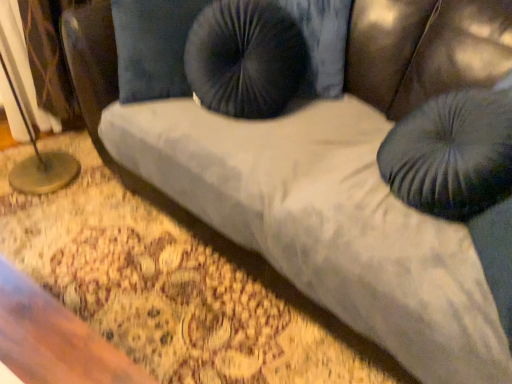
The width and height of the screenshot is (512, 384). What do you see at coordinates (452, 154) in the screenshot?
I see `velvet dark blue bean bag at upper center` at bounding box center [452, 154].

The image size is (512, 384). I want to click on velvet dark blue bean bag at upper center, so click(452, 154).

Is metallic gold table lamp at left thinner than suede-like black pillow at center?

No.

Between metallic gold table lamp at left and suede-like black pillow at center, which one has less height?

suede-like black pillow at center.

Which object is closer to the camera taking this photo, metallic gold table lamp at left or suede-like black pillow at center?

suede-like black pillow at center.

Looking at this image, how many degrees apart are the facing directions of metallic gold table lamp at left and suede-like black pillow at center?

35.1 degrees.

Considering the relative sizes of suede-like black pillow at center and metallic gold table lamp at left in the image provided, is suede-like black pillow at center thinner than metallic gold table lamp at left?

Indeed, suede-like black pillow at center has a lesser width compared to metallic gold table lamp at left.

Would you say suede-like black pillow at center contains metallic gold table lamp at left?

Actually, metallic gold table lamp at left is outside suede-like black pillow at center.

From a real-world perspective, is suede-like black pillow at center positioned above or below metallic gold table lamp at left?

suede-like black pillow at center is situated higher than metallic gold table lamp at left in the real world.

Considering the sizes of objects suede-like black pillow at center and metallic gold table lamp at left in the image provided, who is taller, suede-like black pillow at center or metallic gold table lamp at left?

metallic gold table lamp at left.

Which object is thinner, velvet dark blue bean bag at upper center or metallic gold table lamp at left?

With smaller width is velvet dark blue bean bag at upper center.

Is point (444, 177) closer to camera compared to point (72, 180)?

Yes, point (444, 177) is closer to viewer.

From the image's perspective, is velvet dark blue bean bag at upper center over metallic gold table lamp at left?

Actually, velvet dark blue bean bag at upper center appears below metallic gold table lamp at left in the image.

Considering the sizes of velvet dark blue bean bag at upper center and metallic gold table lamp at left in the image, is velvet dark blue bean bag at upper center taller or shorter than metallic gold table lamp at left?

Considering their sizes, velvet dark blue bean bag at upper center has less height than metallic gold table lamp at left.

Could velvet dark blue bean bag at upper center be considered to be inside metallic gold table lamp at left?

Definitely not — velvet dark blue bean bag at upper center is not inside metallic gold table lamp at left.

Who is taller, metallic gold table lamp at left or velvet dark blue bean bag at upper center?

metallic gold table lamp at left is taller.

From the image's perspective, would you say metallic gold table lamp at left is positioned over velvet dark blue bean bag at upper center?

Yes, from the image's perspective, metallic gold table lamp at left is over velvet dark blue bean bag at upper center.

Is metallic gold table lamp at left next to velvet dark blue bean bag at upper center?

No, metallic gold table lamp at left is not with velvet dark blue bean bag at upper center.

From the picture: Considering the relative sizes of suede-like black pillow at center and velvet dark blue bean bag at upper center in the image provided, is suede-like black pillow at center shorter than velvet dark blue bean bag at upper center?

No, suede-like black pillow at center is not shorter than velvet dark blue bean bag at upper center.

Can you confirm if suede-like black pillow at center is smaller than velvet dark blue bean bag at upper center?

Incorrect, suede-like black pillow at center is not smaller in size than velvet dark blue bean bag at upper center.

The height and width of the screenshot is (384, 512). I want to click on bean bag chair located below the suede-like black pillow at center (from the image's perspective), so click(452, 154).

Is velvet dark blue bean bag at upper center oriented away from suede-like black pillow at center?

No, velvet dark blue bean bag at upper center is not facing away from suede-like black pillow at center.

Between velvet dark blue bean bag at upper center and suede-like black pillow at center, which one has more height?

With more height is suede-like black pillow at center.

Which of these two, velvet dark blue bean bag at upper center or suede-like black pillow at center, is bigger?

With larger size is suede-like black pillow at center.

Considering the sizes of objects velvet dark blue bean bag at upper center and suede-like black pillow at center in the image provided, who is thinner, velvet dark blue bean bag at upper center or suede-like black pillow at center?

suede-like black pillow at center is thinner.

The width and height of the screenshot is (512, 384). What are the coordinates of `pillow located above the metallic gold table lamp at left (from a real-world perspective)` in the screenshot? It's located at (153, 47).

The image size is (512, 384). Find the location of `table lamp on the left of suede-like black pillow at center`. table lamp on the left of suede-like black pillow at center is located at coordinates (40, 161).

When comparing their distances from metallic gold table lamp at left, does suede-like black pillow at center or velvet dark blue bean bag at upper center seem further?

velvet dark blue bean bag at upper center is positioned further to the anchor metallic gold table lamp at left.

From the picture: Considering their positions, is metallic gold table lamp at left positioned closer to velvet dark blue bean bag at upper center than suede-like black pillow at center?

suede-like black pillow at center lies closer to velvet dark blue bean bag at upper center than the other object.

Looking at the image, which one is located further to suede-like black pillow at center, metallic gold table lamp at left or velvet dark blue bean bag at upper center?

velvet dark blue bean bag at upper center is further to suede-like black pillow at center.

Consider the image. Which object lies further to the anchor point metallic gold table lamp at left, velvet dark blue bean bag at upper center or suede-like black pillow at center?

velvet dark blue bean bag at upper center lies further to metallic gold table lamp at left than the other object.

Looking at the image, which one is located further to suede-like black pillow at center, velvet dark blue bean bag at upper center or metallic gold table lamp at left?

Among the two, velvet dark blue bean bag at upper center is located further to suede-like black pillow at center.

When comparing their distances from velvet dark blue bean bag at upper center, does suede-like black pillow at center or metallic gold table lamp at left seem closer?

suede-like black pillow at center is positioned closer to the anchor velvet dark blue bean bag at upper center.

What are the coordinates of `pillow between metallic gold table lamp at left and velvet dark blue bean bag at upper center from left to right` in the screenshot? It's located at (153, 47).